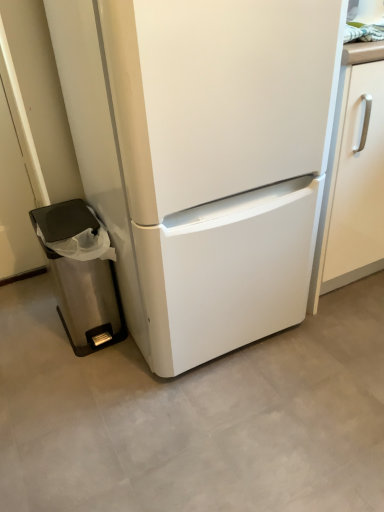
Where is `free space in front of white matte refrigerator at center`? The image size is (384, 512). free space in front of white matte refrigerator at center is located at coordinates (210, 428).